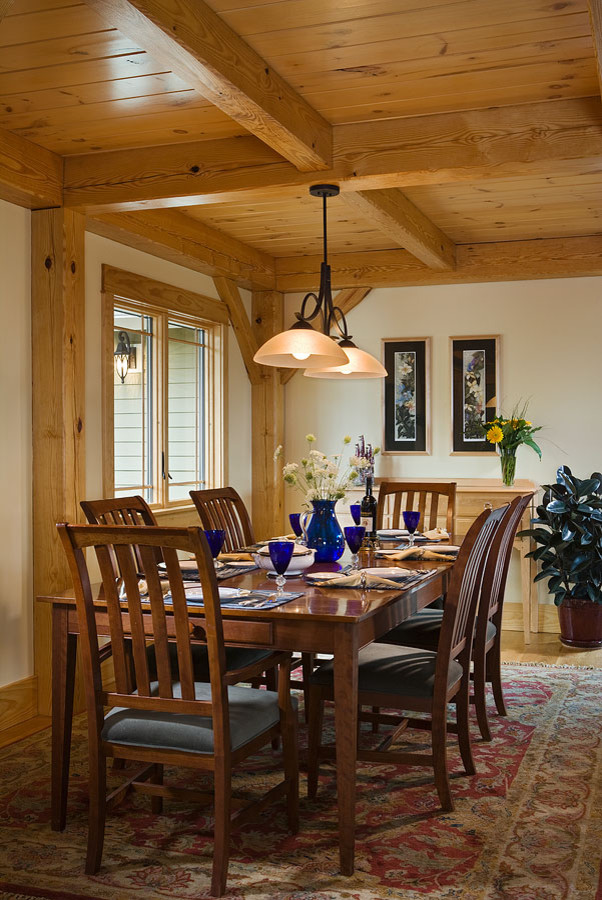
Image resolution: width=602 pixels, height=900 pixels. Identify the location of sideboard. (478, 490).